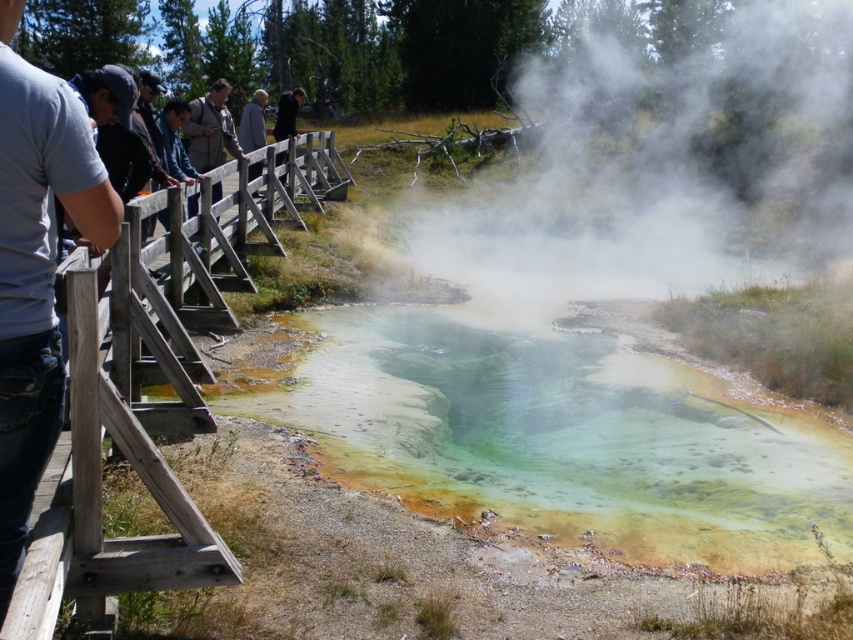
Question: Which point is farther to the camera?

Choices:
 (A) green sedimentary water at center
 (B) khaki fabric jacket at center
 (C) white translucent steam at upper center

Answer: (C)

Question: Can you confirm if green sedimentary water at center is wider than weathered wood fence at left?

Choices:
 (A) no
 (B) yes

Answer: (B)

Question: Which object is closer to the camera taking this photo?

Choices:
 (A) weathered wood fence at left
 (B) green sedimentary water at center
 (C) gray cotton shirt at left
 (D) khaki fabric jacket at center

Answer: (C)

Question: Which of the following is the closest to the observer?

Choices:
 (A) (540, 115)
 (B) (44, 612)

Answer: (B)

Question: Where is green sedimentary water at center located in relation to white translucent steam at upper center in the image?

Choices:
 (A) left
 (B) right

Answer: (A)

Question: Considering the relative positions of white translucent steam at upper center and gray cotton shirt at left in the image provided, where is white translucent steam at upper center located with respect to gray cotton shirt at left?

Choices:
 (A) left
 (B) right

Answer: (B)